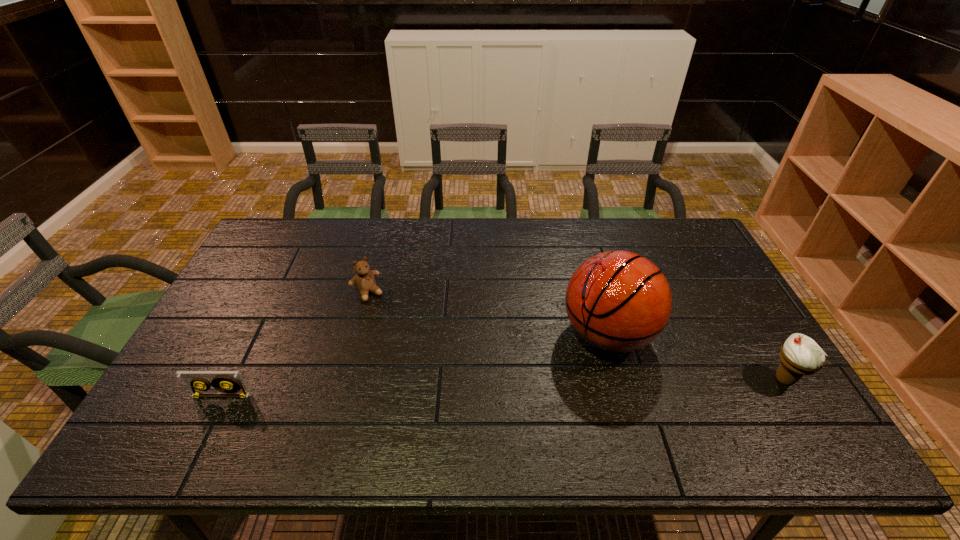
At what (x,y) coordinates should I click in order to perform the action: click on vacant region located on the side with spill of the basketball. Please return your answer as a coordinate pair (x, y). Looking at the image, I should click on (478, 416).

Where is `free region located on the side with spill of the basketball`? free region located on the side with spill of the basketball is located at coordinates (559, 365).

The height and width of the screenshot is (540, 960). What are the coordinates of `free space located on the front-facing side of the third object from right to left` in the screenshot? It's located at (425, 374).

In order to click on vacant region located on the front-facing side of the third object from right to left in this screenshot , I will do `click(418, 364)`.

This screenshot has width=960, height=540. I want to click on vacant space located 0.130m on the front-facing side of the third object from right to left, so click(x=393, y=328).

You are a GUI agent. You are given a task and a screenshot of the screen. Output one action in this format:
    pyautogui.click(x=<x>, y=<y>)
    Task: Click on the videotape located in the near edge section of the desktop
    This screenshot has width=960, height=540.
    Given the screenshot: What is the action you would take?
    pyautogui.click(x=225, y=383)

In order to click on icecream positioned at the near edge in this screenshot , I will do click(x=800, y=355).

Find the location of a particular element. Image resolution: width=960 pixels, height=540 pixels. object that is at the left edge is located at coordinates (225, 383).

Image resolution: width=960 pixels, height=540 pixels. I want to click on object located in the right edge section of the desktop, so click(x=800, y=355).

Locate an element on the screen. Image resolution: width=960 pixels, height=540 pixels. object situated at the near left corner is located at coordinates (225, 383).